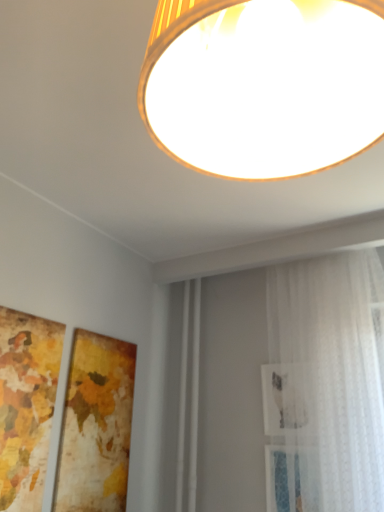
Question: Considering the relative positions of wooden textured frame at lower left, the second picture frame positioned from the left, and wooden map at left, which ranks as the second picture frame in right-to-left order, in the image provided, is wooden textured frame at lower left, the second picture frame positioned from the left, to the left or to the right of wooden map at left, which ranks as the second picture frame in right-to-left order,?

Choices:
 (A) right
 (B) left

Answer: (A)

Question: Relative to wooden map at left, the 1th picture frame viewed from the left, is wooden textured frame at lower left, which ranks as the first picture frame in right-to-left order, in front or behind?

Choices:
 (A) behind
 (B) front

Answer: (A)

Question: Estimate the real-world distances between objects in this image. Which object is closer to the white sheer curtain at right?

Choices:
 (A) matte gold lampshade at upper center
 (B) wooden map at left, which ranks as the second picture frame in right-to-left order
 (C) wooden textured frame at lower left, the second picture frame positioned from the left

Answer: (C)

Question: Which is farther from the white sheer curtain at right?

Choices:
 (A) matte gold lampshade at upper center
 (B) wooden textured frame at lower left, which ranks as the first picture frame in right-to-left order
 (C) wooden map at left, which ranks as the second picture frame in right-to-left order

Answer: (A)